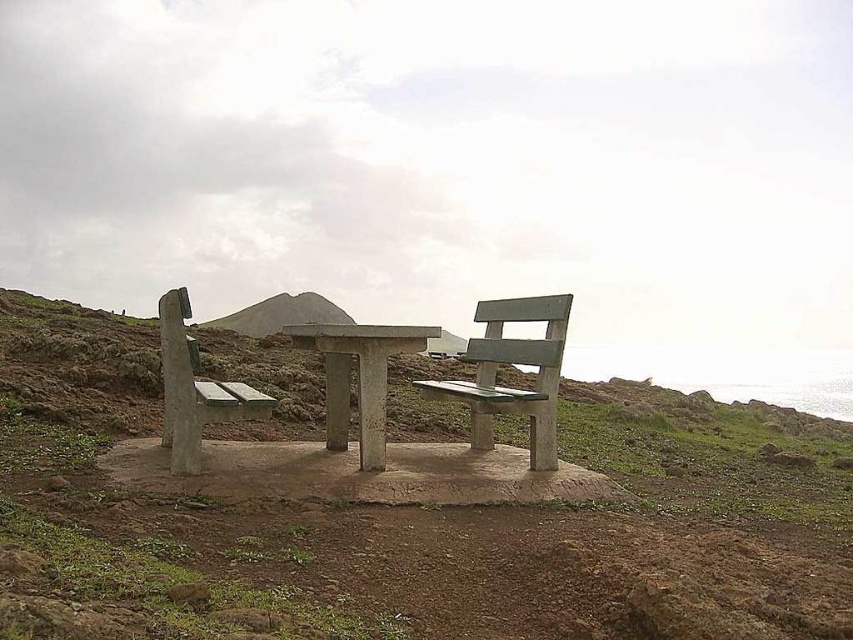
Question: Is concrete bench at center above smooth concrete bench at left?

Choices:
 (A) no
 (B) yes

Answer: (A)

Question: Which of the following is the closest to the observer?

Choices:
 (A) brushed concrete hillside at center
 (B) smooth concrete bench at left
 (C) green matte bench at center
 (D) green painted wood bench at center

Answer: (C)

Question: Which point is closer to the camera?

Choices:
 (A) green painted wood bench at center
 (B) concrete bench at center
 (C) green matte bench at center
 (D) brushed concrete hillside at center

Answer: (C)

Question: Is green painted wood bench at center in front of brushed concrete hillside at center?

Choices:
 (A) no
 (B) yes

Answer: (B)

Question: In this image, where is green matte bench at center located relative to concrete bench at center?

Choices:
 (A) left
 (B) right

Answer: (B)

Question: Which of the following is the farthest from the observer?

Choices:
 (A) smooth concrete bench at left
 (B) green matte bench at center

Answer: (A)